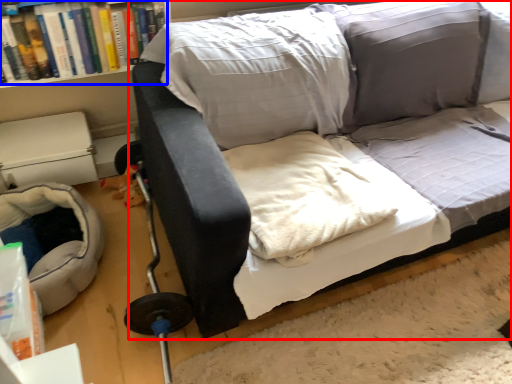
Question: Which object is closer to the camera taking this photo, studio couch (highlighted by a red box) or book (highlighted by a blue box)?

Choices:
 (A) studio couch
 (B) book

Answer: (A)